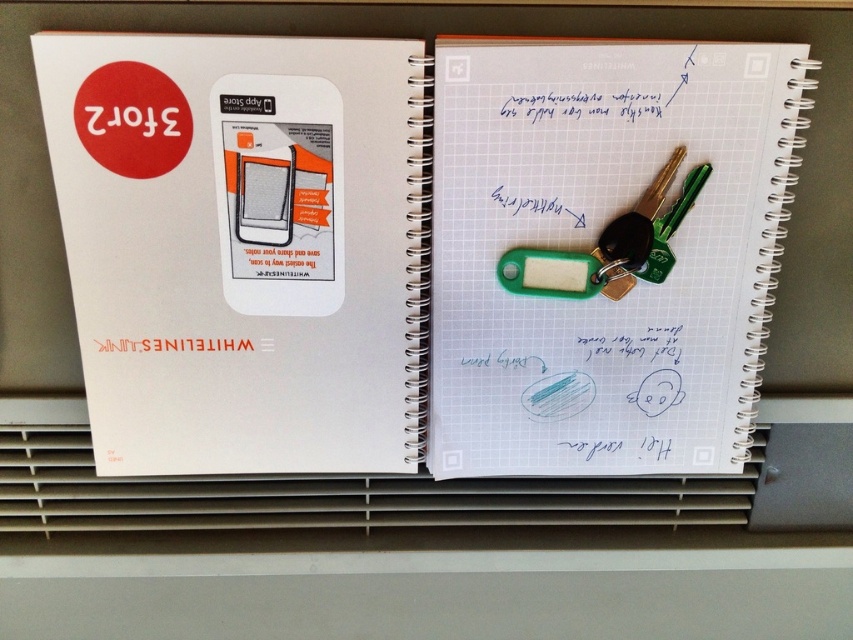
You are organizing a desk and need to place a 3.5 inch wide memo note between the white grid paper at center and the green plastic keychain at center. Can you fit it there?

The white grid paper at center and green plastic keychain at center are 2.68 inches apart. Since the memo note is 3.5 inches wide, it is wider than the space between them. Therefore, the memo note cannot fit between the white grid paper at center and the green plastic keychain at center.

You are organizing a desk and see the white grid paper at center and the green plastic keychain at center. Which object is wider?

The white grid paper at center is wider than the green plastic keychain at center.